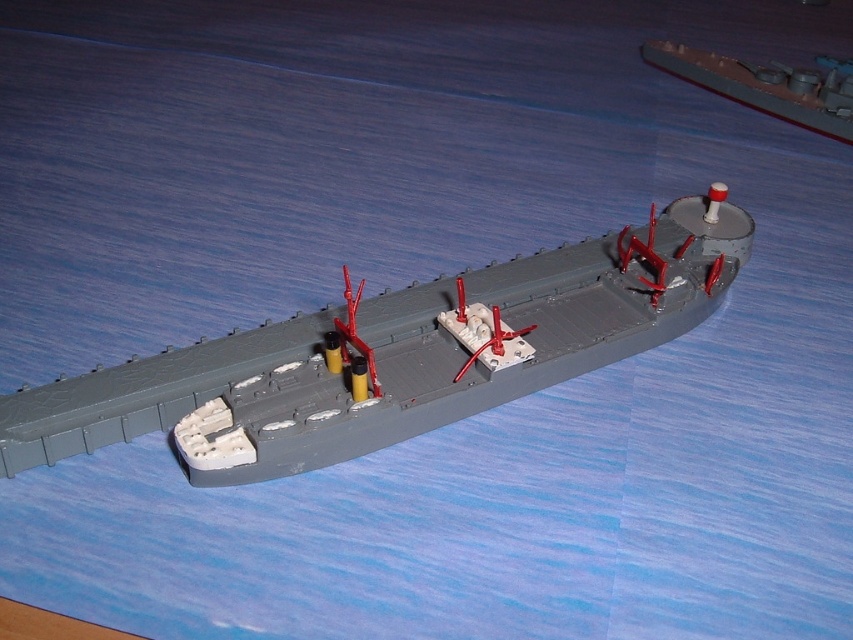
Can you confirm if gray matte ship at center is thinner than gray matte ship at upper right?

Incorrect, gray matte ship at center's width is not less than gray matte ship at upper right's.

Who is more distant from viewer, (x=502, y=376) or (x=781, y=112)?

The point (x=781, y=112) is behind.

Between point (355, 374) and point (714, 74), which one is positioned in front?

Positioned in front is point (355, 374).

At what (x,y) coordinates should I click in order to perform the action: click on gray matte ship at center. Please return your answer as a coordinate pair (x, y). Looking at the image, I should click on (393, 355).